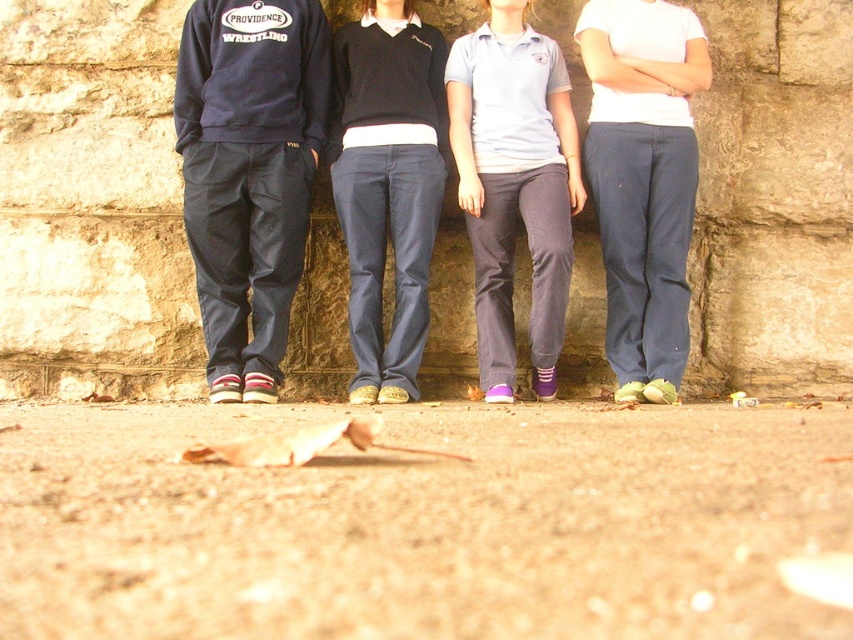
Question: Can you confirm if stone at center is positioned to the right of dark blue denim pants at center?

Choices:
 (A) yes
 (B) no

Answer: (B)

Question: Which object is the farthest from the dark blue cotton pants at left?

Choices:
 (A) white cotton pants at center
 (B) dark blue denim pants at center

Answer: (A)

Question: Estimate the real-world distances between objects in this image. Which object is closer to the gray cotton pants at center?

Choices:
 (A) dark blue cotton pants at left
 (B) stone at center
 (C) dark blue denim pants at center

Answer: (C)

Question: In this image, where is white cotton pants at center located relative to dark blue denim pants at center?

Choices:
 (A) above
 (B) below

Answer: (A)

Question: Which of the following is the farthest from the observer?

Choices:
 (A) gray cotton pants at center
 (B) stone at center
 (C) dark blue denim pants at center
 (D) white cotton pants at center

Answer: (B)

Question: Is the position of stone at center less distant than that of gray cotton pants at center?

Choices:
 (A) no
 (B) yes

Answer: (A)